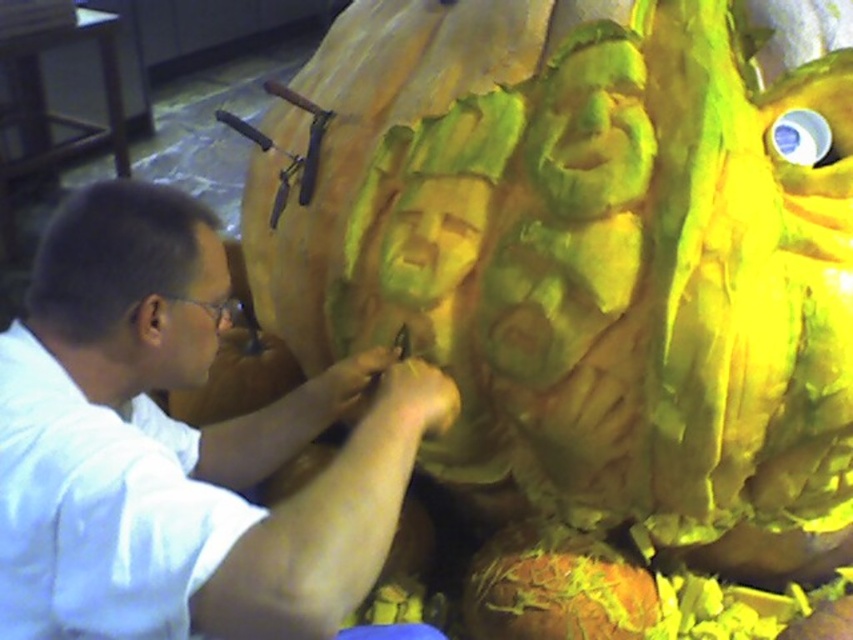
Which is in front, point (100, 406) or point (189, 326)?

Point (100, 406) is more forward.

Can you confirm if white matte shirt at center is positioned below matte white face at lower left?

Yes.

Between point (305, 497) and point (155, 330), which one is positioned in front?

Positioned in front is point (305, 497).

In order to click on white matte shirt at center in this screenshot , I will do `click(178, 445)`.

Does green matte pumpkin face at center have a greater height compared to matte white face at lower left?

Yes, green matte pumpkin face at center is taller than matte white face at lower left.

Describe the element at coordinates (590, 128) in the screenshot. I see `green matte pumpkin face at center` at that location.

Between point (589, 134) and point (196, 241), which one is positioned in front?

Point (196, 241) is more forward.

Locate an element on the screen. green matte pumpkin face at center is located at coordinates (590, 128).

Between white matte shirt at center and green matte pumpkin face at center, which one appears on the left side from the viewer's perspective?

white matte shirt at center

Looking at this image, between white matte shirt at center and green matte pumpkin face at center, which one has less height?

With less height is green matte pumpkin face at center.

Locate an element on the screen. The image size is (853, 640). white matte shirt at center is located at coordinates (178, 445).